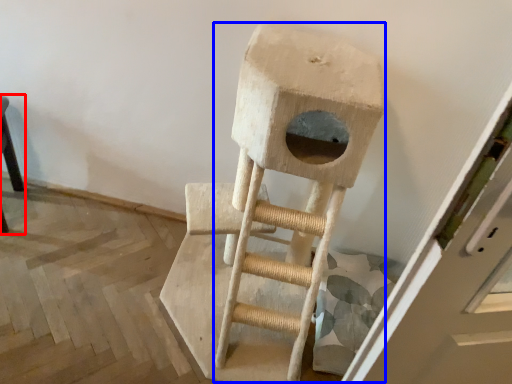
Question: Which object appears closest to the camera in this image, furniture (highlighted by a red box) or ladder (highlighted by a blue box)?

Choices:
 (A) furniture
 (B) ladder

Answer: (B)